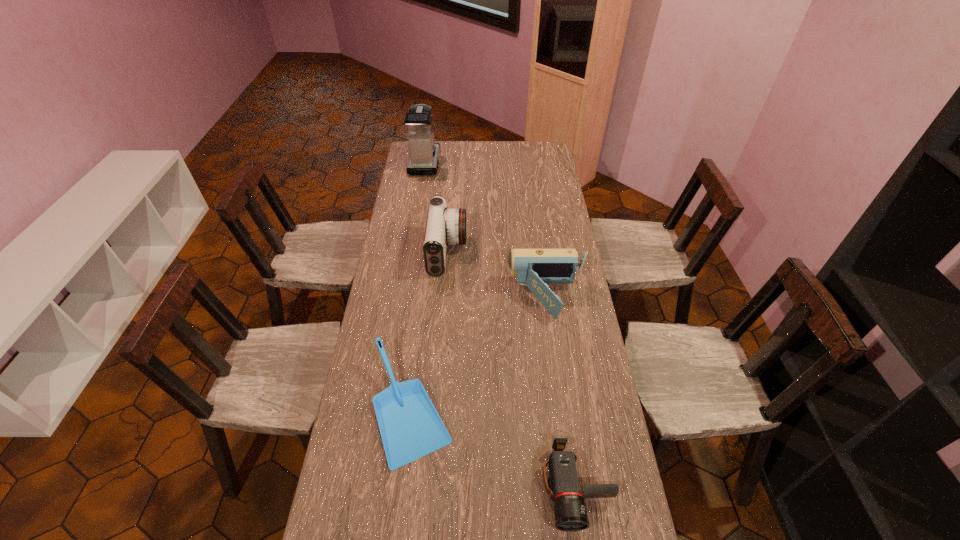
This screenshot has width=960, height=540. I want to click on object identified as the third closest to the dustpan, so pos(445,226).

Identify the location of camcorder that stands as the closest to the dustpan. (534, 268).

I want to click on camcorder that is the second nearest to the shortest camcorder, so click(445, 226).